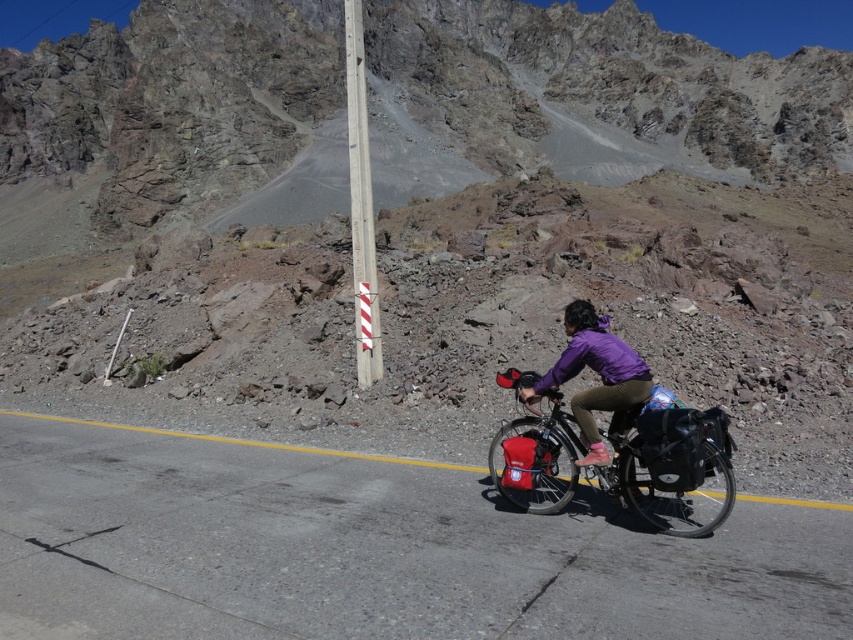
Question: Which point appears closest to the camera in this image?

Choices:
 (A) [x=579, y=324]
 (B) [x=363, y=65]
 (C) [x=531, y=429]

Answer: (C)

Question: Can you confirm if gray asphalt road at center is positioned above matte black bicycle at center?

Choices:
 (A) yes
 (B) no

Answer: (B)

Question: Which point appears farthest from the camera in this image?

Choices:
 (A) (660, 524)
 (B) (352, 33)

Answer: (B)

Question: Is gray asphalt road at center positioned behind white striped concrete pole at center?

Choices:
 (A) no
 (B) yes

Answer: (A)

Question: Which point is closer to the camera?

Choices:
 (A) (380, 493)
 (B) (676, 468)
 (C) (346, 13)

Answer: (B)

Question: Is gray asphalt road at center closer to the viewer compared to white striped concrete pole at center?

Choices:
 (A) yes
 (B) no

Answer: (A)